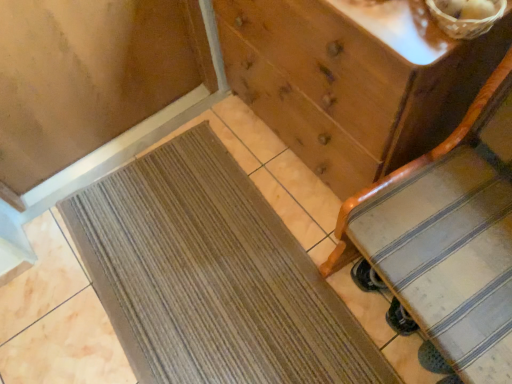
Question: Considering their positions, is striped fabric suitcase at right located in front of or behind brown woven basket at upper right?

Choices:
 (A) front
 (B) behind

Answer: (A)

Question: Is point (459, 215) closer or farther from the camera than point (462, 18)?

Choices:
 (A) closer
 (B) farther

Answer: (B)

Question: Estimate the real-world distances between objects in this image. Which object is closer to the brown woven basket at upper right?

Choices:
 (A) striped fabric suitcase at right
 (B) brown woven mat at lower left
 (C) wooden chest of drawers at center

Answer: (C)

Question: Estimate the real-world distances between objects in this image. Which object is farther from the wooden chest of drawers at center?

Choices:
 (A) striped fabric suitcase at right
 (B) brown woven basket at upper right
 (C) brown woven mat at lower left

Answer: (C)